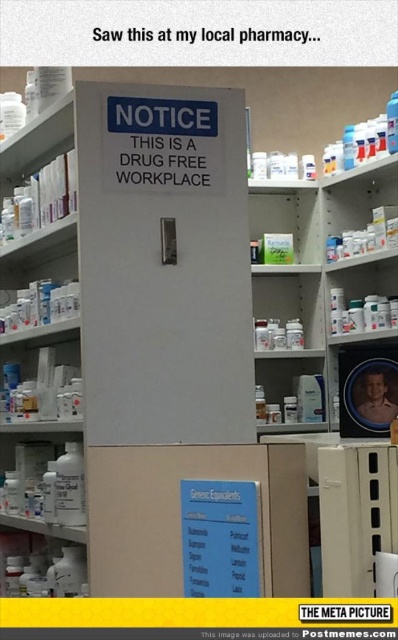
Question: Can you confirm if green matte box at center is positioned below matte plastic shelf at center?

Choices:
 (A) no
 (B) yes

Answer: (A)

Question: Based on their relative distances, which object is nearer to the white plastic shelves at upper center?

Choices:
 (A) white matte sign at center
 (B) green matte box at center

Answer: (B)

Question: Is white plastic shelves at upper center further to camera compared to matte plastic shelf at center?

Choices:
 (A) yes
 (B) no

Answer: (B)

Question: Among these objects, which one is nearest to the camera?

Choices:
 (A) white plastic bottle at lower left
 (B) white matte sign at center
 (C) white plastic shelves at upper center

Answer: (B)

Question: Which point is farther from the camera taking this photo?

Choices:
 (A) (87, 336)
 (B) (275, 403)

Answer: (B)

Question: Can you confirm if white matte sign at center is thinner than white plastic shelves at center?

Choices:
 (A) yes
 (B) no

Answer: (B)